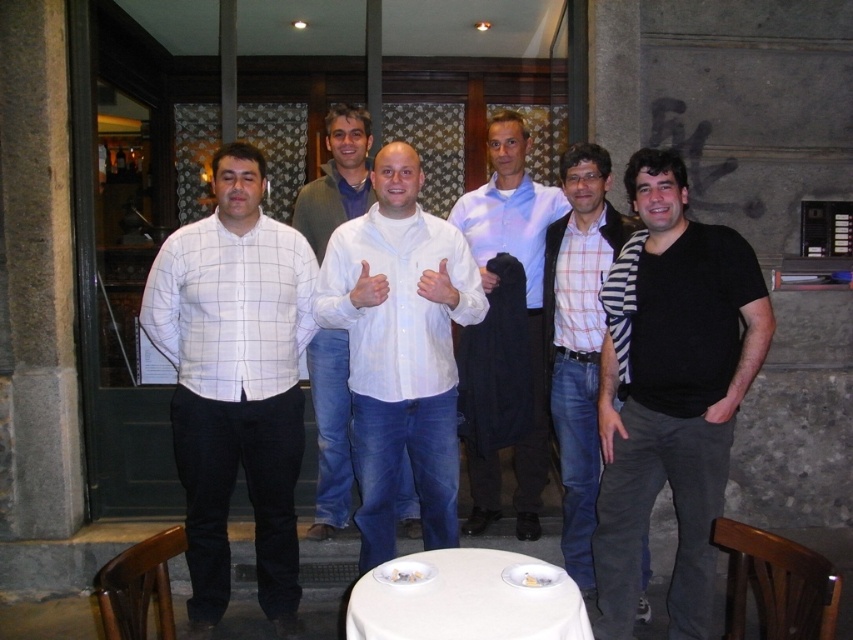
Question: Considering the relative positions of black matte shirt at right and white matte shirt at center in the image provided, where is black matte shirt at right located with respect to white matte shirt at center?

Choices:
 (A) below
 (B) above

Answer: (B)

Question: Which point is farther to the camera?

Choices:
 (A) white shirt at center
 (B) white checkered shirt at center

Answer: (B)

Question: Which point is closer to the camera?

Choices:
 (A) (645, 371)
 (B) (299, 428)

Answer: (A)

Question: Can you confirm if white shirt at center is thinner than light blue shirt at center?

Choices:
 (A) no
 (B) yes

Answer: (A)

Question: Which object is closer to the camera taking this photo?

Choices:
 (A) white shirt at center
 (B) white matte shirt at center
 (C) light blue shirt at center
 (D) white checkered shirt at left

Answer: (A)

Question: Does white shirt at center have a lesser width compared to light blue shirt at center?

Choices:
 (A) no
 (B) yes

Answer: (A)